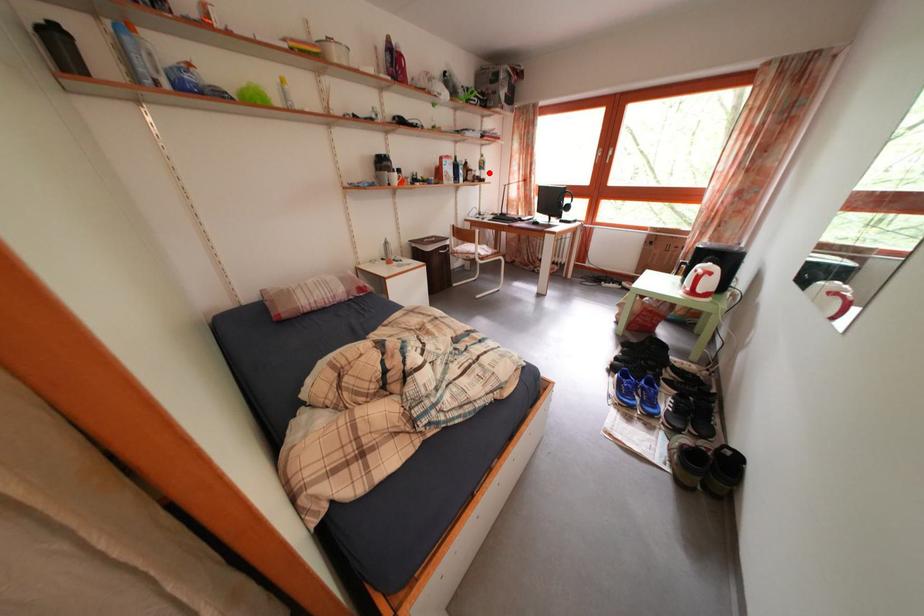
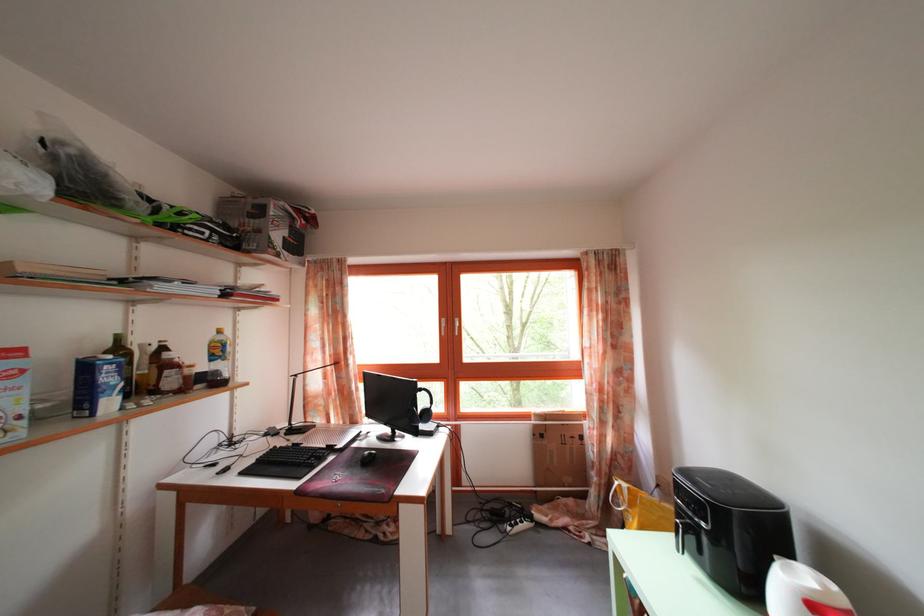
Find the pixel in the second image that matches the highlighted location in the first image.

(225, 359)